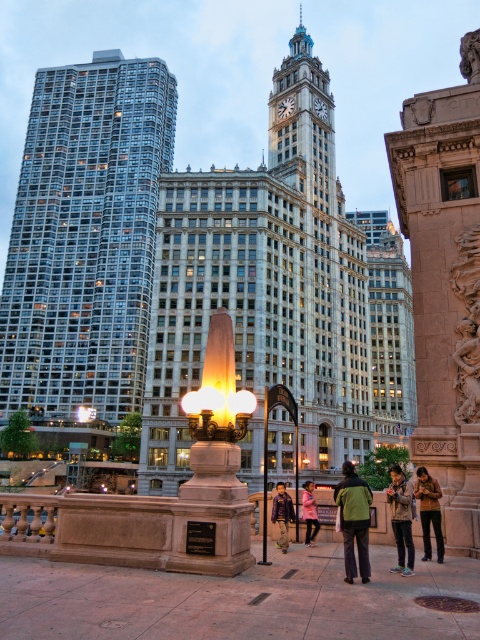
Question: Which object is positioned farthest from the purple leather jacket at center?

Choices:
 (A) brown leather jacket at lower right
 (B) carved stone monument at right
 (C) pink fabric jacket at center
 (D) glassy reflective building at left

Answer: (D)

Question: Is brown leather jacket at lower right thinner than carved stone face at upper right?

Choices:
 (A) no
 (B) yes

Answer: (B)

Question: Does dark green jacket at center appear on the right side of purple leather jacket at center?

Choices:
 (A) yes
 (B) no

Answer: (A)

Question: Based on their relative distances, which object is farther from the carved stone monument at right?

Choices:
 (A) carved stone cherub at right
 (B) khaki cotton jacket at center

Answer: (B)

Question: Which object appears closest to the camera in this image?

Choices:
 (A) khaki cotton jacket at center
 (B) gold textured building at center
 (C) purple leather jacket at center
 (D) white marble clock tower at center

Answer: (A)

Question: Is polished steel clock tower at upper center in front of brown leather jacket at lower right?

Choices:
 (A) yes
 (B) no

Answer: (B)